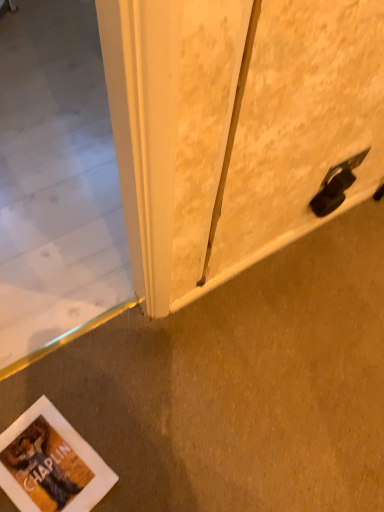
Question: In terms of height, does matte white screen door at right look taller or shorter compared to white matte concrete at lower left?

Choices:
 (A) tall
 (B) short

Answer: (A)

Question: Is matte white screen door at right spatially inside white matte concrete at lower left, or outside of it?

Choices:
 (A) inside
 (B) outside

Answer: (B)

Question: From the image's perspective, is matte white screen door at right above or below white matte concrete at lower left?

Choices:
 (A) below
 (B) above

Answer: (B)

Question: Is white matte concrete at lower left bigger or smaller than matte white screen door at right?

Choices:
 (A) big
 (B) small

Answer: (A)

Question: Considering the positions of white matte concrete at lower left and matte white screen door at right in the image, is white matte concrete at lower left wider or thinner than matte white screen door at right?

Choices:
 (A) wide
 (B) thin

Answer: (A)

Question: From the image's perspective, relative to matte white screen door at right, is white matte concrete at lower left above or below?

Choices:
 (A) below
 (B) above

Answer: (A)

Question: From a real-world perspective, is white matte concrete at lower left physically located above or below matte white screen door at right?

Choices:
 (A) below
 (B) above

Answer: (A)